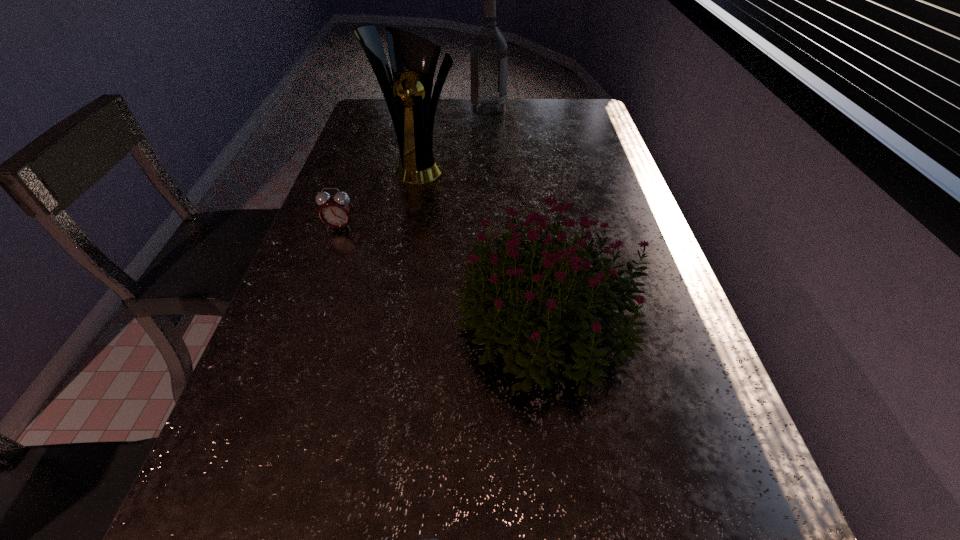
Identify the location of free space that satisfies the following two spatial constraints: 1. at the front of the bouquet, where the globe is visible; 2. on the left side of the second farthest object. (390, 323).

This screenshot has height=540, width=960. Find the location of `blank space that satisfies the following two spatial constraints: 1. on the front-facing side of the fourth farthest object; 2. on the right side of the farthest object`. blank space that satisfies the following two spatial constraints: 1. on the front-facing side of the fourth farthest object; 2. on the right side of the farthest object is located at coordinates (494, 323).

Locate an element on the screen. The width and height of the screenshot is (960, 540). free space that satisfies the following two spatial constraints: 1. on the clock face of the alarm clock; 2. on the left side of the third shortest object is located at coordinates (306, 323).

Identify the location of blank space that satisfies the following two spatial constraints: 1. on the front-facing side of the farthest object; 2. at the front of the second farthest object, where the globe is visible. (490, 167).